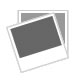
Where is `papers`? papers is located at coordinates pyautogui.click(x=32, y=61), pyautogui.click(x=60, y=19).